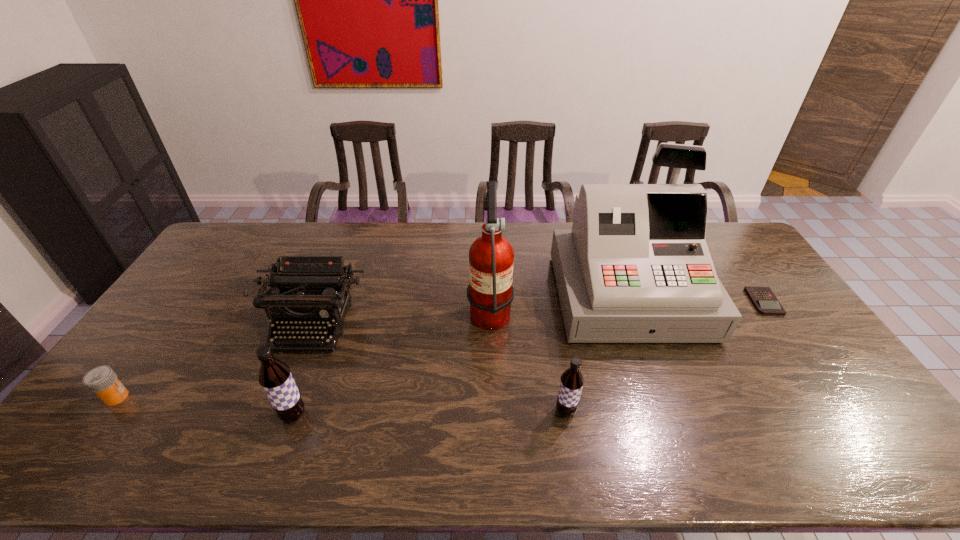
Where is `object present at the far edge`? This screenshot has width=960, height=540. object present at the far edge is located at coordinates (635, 268).

Where is `medicine at the near edge`? This screenshot has width=960, height=540. medicine at the near edge is located at coordinates (102, 380).

Where is `object that is at the left edge`? The height and width of the screenshot is (540, 960). object that is at the left edge is located at coordinates (102, 380).

This screenshot has width=960, height=540. I want to click on object at the right edge, so click(x=763, y=299).

You are a GUI agent. You are given a task and a screenshot of the screen. Output one action in this format:
    pyautogui.click(x=<x>, y=<y>)
    Task: Click on the object that is at the near left corner
    The height and width of the screenshot is (540, 960).
    Given the screenshot: What is the action you would take?
    pyautogui.click(x=102, y=380)

Locate an element on the screen. The width and height of the screenshot is (960, 540). free space at the far edge of the desktop is located at coordinates (477, 232).

The width and height of the screenshot is (960, 540). Identify the location of free space at the near edge of the desktop. (517, 416).

This screenshot has height=540, width=960. I want to click on vacant space at the left edge, so click(x=153, y=330).

Locate an element on the screen. The height and width of the screenshot is (540, 960). vacant region at the right edge of the desktop is located at coordinates (803, 335).

Image resolution: width=960 pixels, height=540 pixels. In the image, there is a desktop. In order to click on vacant area at the near left corner in this screenshot , I will do `click(136, 412)`.